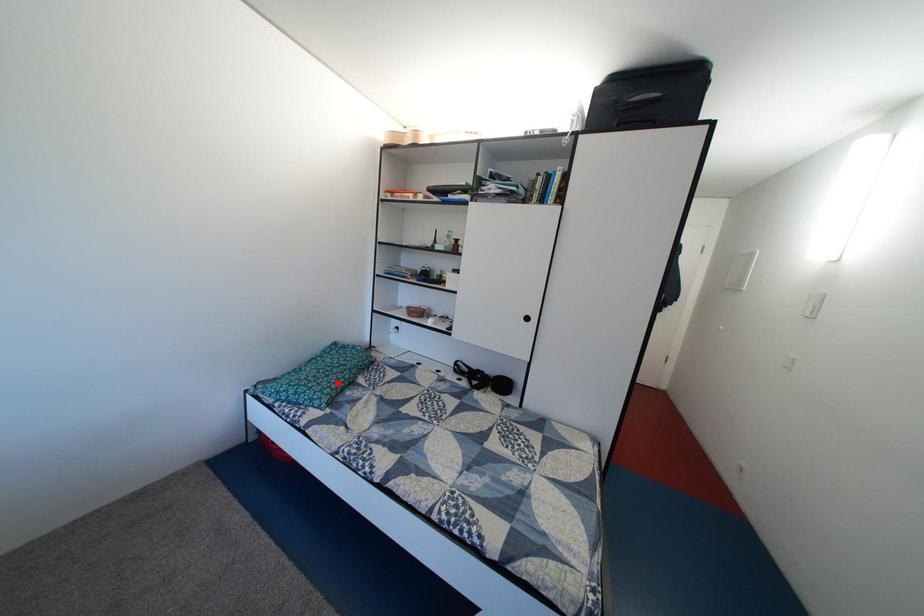
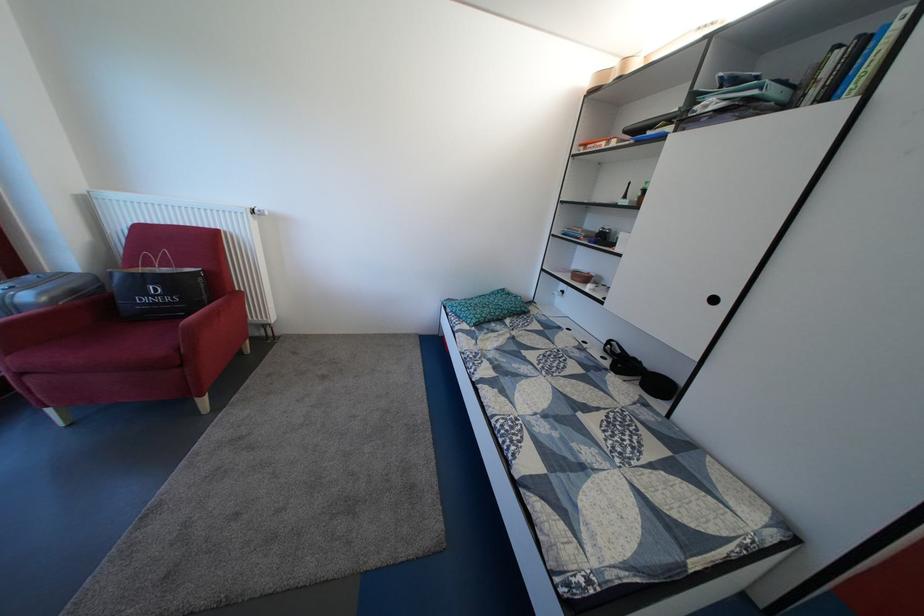
Question: A red point is marked in image1. In image2, is the corresponding 3D point closer to the camera or farther? Reply with the corresponding letter.

Choices:
 (A) The corresponding 3D point is closer.
 (B) The corresponding 3D point is farther.

Answer: (B)